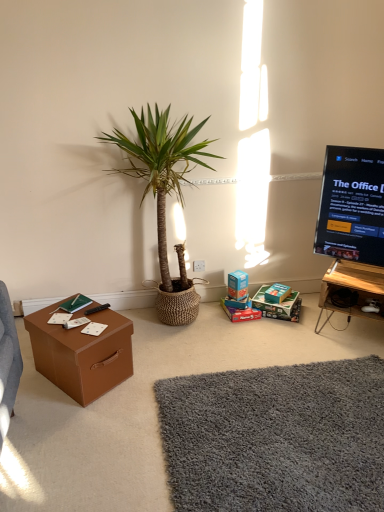
At what (x,y) coordinates should I click in order to perform the action: click on vacant space situated on the left part of matte cardboard box at lower center, which ranks as the 3th storage box in right-to-left order. Please return your answer as a coordinate pair (x, y). This screenshot has width=384, height=512. Looking at the image, I should click on (210, 316).